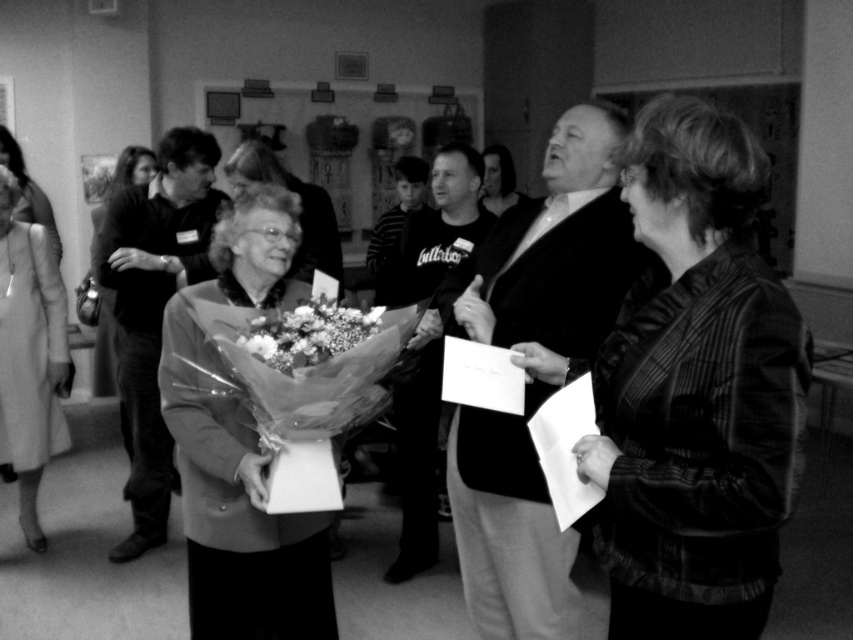
Question: Is matte gray blazer at center bigger than fluffy paper bouquet at center?

Choices:
 (A) yes
 (B) no

Answer: (A)

Question: Which of the following is the closest to the observer?

Choices:
 (A) (200, 508)
 (B) (482, 150)
 (C) (143, 548)
 (D) (57, 404)

Answer: (A)

Question: Is striped fabric jacket at center wider than smooth beige coat at left?

Choices:
 (A) no
 (B) yes

Answer: (B)

Question: Which object appears closest to the camera in this image?

Choices:
 (A) smooth black shirt at center
 (B) smooth beige coat at left
 (C) smooth fabric coat at center

Answer: (C)

Question: Which point appears farthest from the camera in this image?

Choices:
 (A) (136, 381)
 (B) (399, 452)
 (C) (242, 547)

Answer: (B)

Question: Is smooth black jacket at center positioned before silky beige coat at left?

Choices:
 (A) yes
 (B) no

Answer: (A)